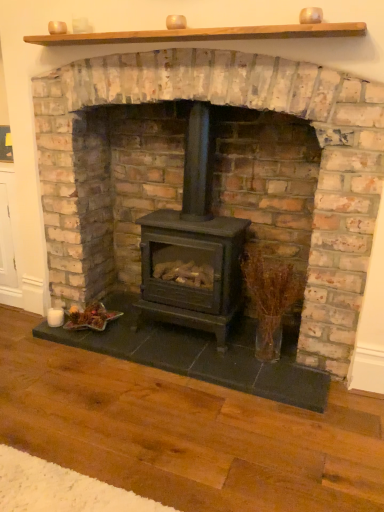
Question: Is black matte wood stove at center touching black matte wood burning stove at center?

Choices:
 (A) yes
 (B) no

Answer: (B)

Question: Considering the relative sizes of black matte wood stove at center and black matte wood burning stove at center in the image provided, is black matte wood stove at center shorter than black matte wood burning stove at center?

Choices:
 (A) no
 (B) yes

Answer: (A)

Question: Could you tell me if black matte wood stove at center is turned towards black matte wood burning stove at center?

Choices:
 (A) yes
 (B) no

Answer: (A)

Question: Is black matte wood stove at center closer to camera compared to black matte wood burning stove at center?

Choices:
 (A) no
 (B) yes

Answer: (B)

Question: Is black matte wood stove at center to the left of black matte wood burning stove at center from the viewer's perspective?

Choices:
 (A) yes
 (B) no

Answer: (B)

Question: Is translucent glass vase at right situated inside black matte wood stove at center or outside?

Choices:
 (A) inside
 (B) outside

Answer: (A)

Question: Does point (286, 308) appear closer or farther from the camera than point (82, 137)?

Choices:
 (A) farther
 (B) closer

Answer: (B)

Question: Is translucent glass vase at right wider or thinner than black matte wood stove at center?

Choices:
 (A) thin
 (B) wide

Answer: (A)

Question: Is translucent glass vase at right to the left or to the right of black matte wood stove at center in the image?

Choices:
 (A) right
 (B) left

Answer: (A)

Question: Is black matte wood burning stove at center in front of or behind translucent glass vase at right in the image?

Choices:
 (A) front
 (B) behind

Answer: (A)

Question: Would you say black matte wood burning stove at center is inside or outside translucent glass vase at right?

Choices:
 (A) outside
 (B) inside

Answer: (A)

Question: Visually, is black matte wood burning stove at center positioned to the left or to the right of translucent glass vase at right?

Choices:
 (A) right
 (B) left

Answer: (B)

Question: Considering the positions of point (147, 298) and point (279, 265), is point (147, 298) closer or farther from the camera than point (279, 265)?

Choices:
 (A) farther
 (B) closer

Answer: (A)

Question: From a real-world perspective, is black matte wood stove at center positioned above or below black matte wood burning stove at center?

Choices:
 (A) below
 (B) above

Answer: (B)

Question: Do you think black matte wood stove at center is within black matte wood burning stove at center, or outside of it?

Choices:
 (A) inside
 (B) outside

Answer: (B)